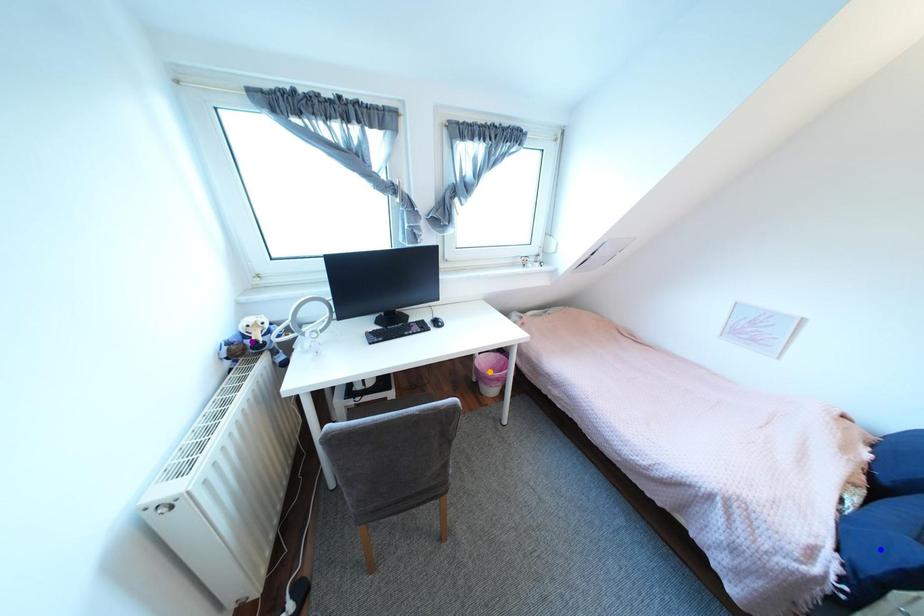
Order these from nearest to farthest:
A) orange point
B) blue point
C) purple point

orange point
purple point
blue point